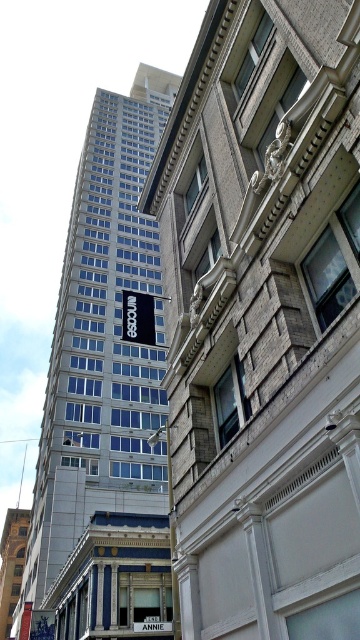
Question: Which of the following is the closest to the observer?

Choices:
 (A) black matte sign at upper center
 (B) metallic pole at center

Answer: (B)

Question: Is metallic pole at center closer to camera compared to white plastic sign at center?

Choices:
 (A) no
 (B) yes

Answer: (B)

Question: Does black matte sign at upper center appear under metallic pole at center?

Choices:
 (A) no
 (B) yes

Answer: (A)

Question: Which of these objects is positioned closest to the white plastic sign at center?

Choices:
 (A) metallic pole at center
 (B) black matte sign at upper center

Answer: (A)

Question: Estimate the real-world distances between objects in this image. Which object is closer to the black matte sign at upper center?

Choices:
 (A) metallic pole at center
 (B) white plastic sign at center

Answer: (A)

Question: Does metallic pole at center appear on the right side of white plastic sign at center?

Choices:
 (A) no
 (B) yes

Answer: (B)